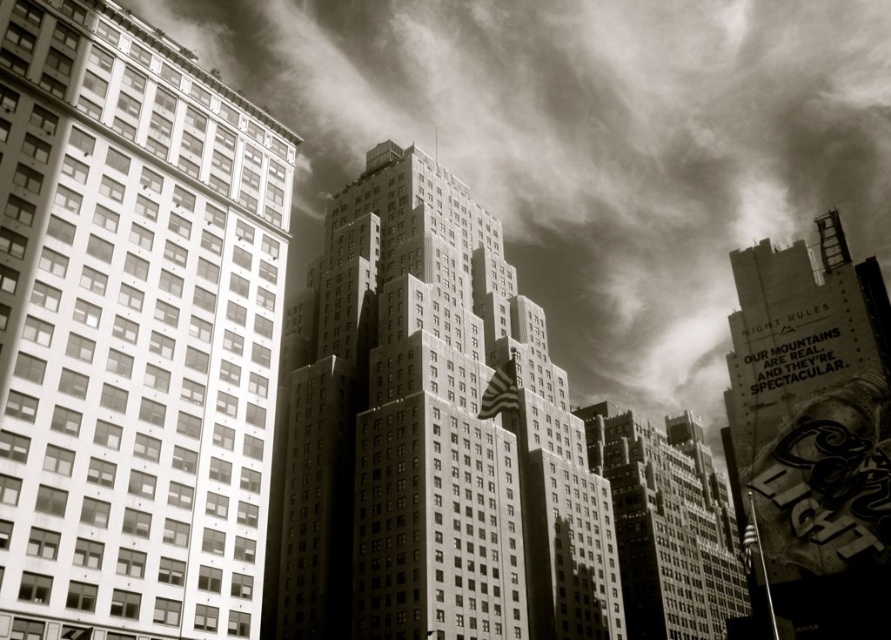
Question: Which object appears farthest from the camera in this image?

Choices:
 (A) cloudy sky at upper center
 (B) smooth concrete skyscraper at center

Answer: (A)

Question: Which of the following is the farthest from the observer?

Choices:
 (A) (683, 470)
 (B) (537, 269)
 (C) (561, 435)

Answer: (B)

Question: Is cloudy sky at upper center smaller than smooth stone skyscraper at center?

Choices:
 (A) no
 (B) yes

Answer: (A)

Question: Is smooth concrete skyscraper at center to the right of smooth stone skyscraper at center from the viewer's perspective?

Choices:
 (A) yes
 (B) no

Answer: (B)

Question: Which point is farther from the camera taking this photo?

Choices:
 (A) (697, 1)
 (B) (693, 484)

Answer: (A)

Question: Is cloudy sky at upper center above smooth glass building at left?

Choices:
 (A) no
 (B) yes

Answer: (B)